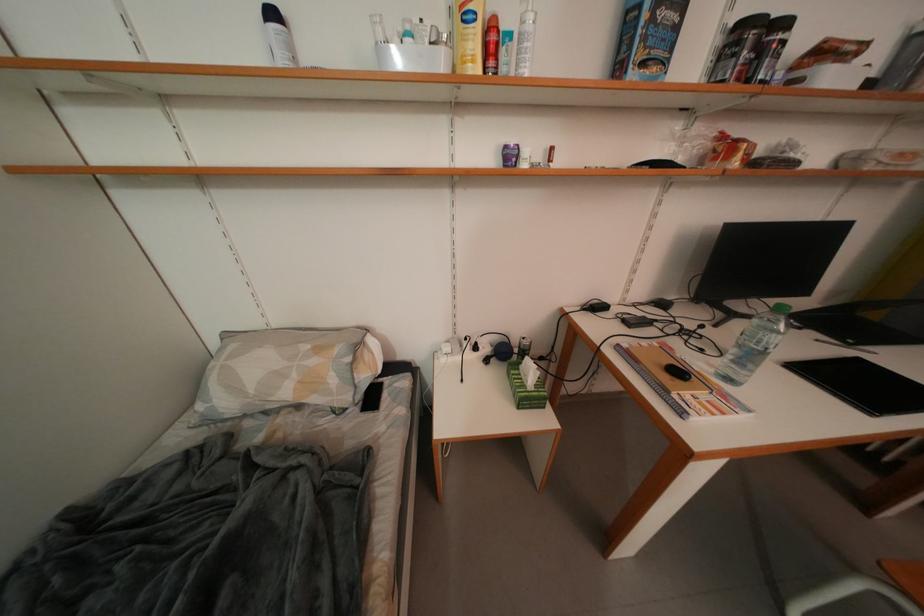
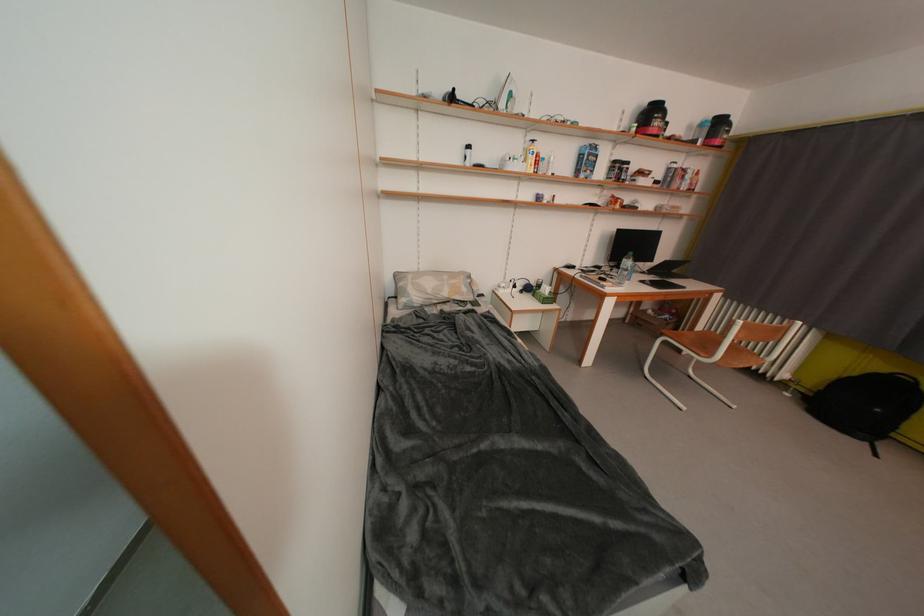
Where in the second image is the point corresponding to (x=341, y=384) from the first image?

(471, 293)